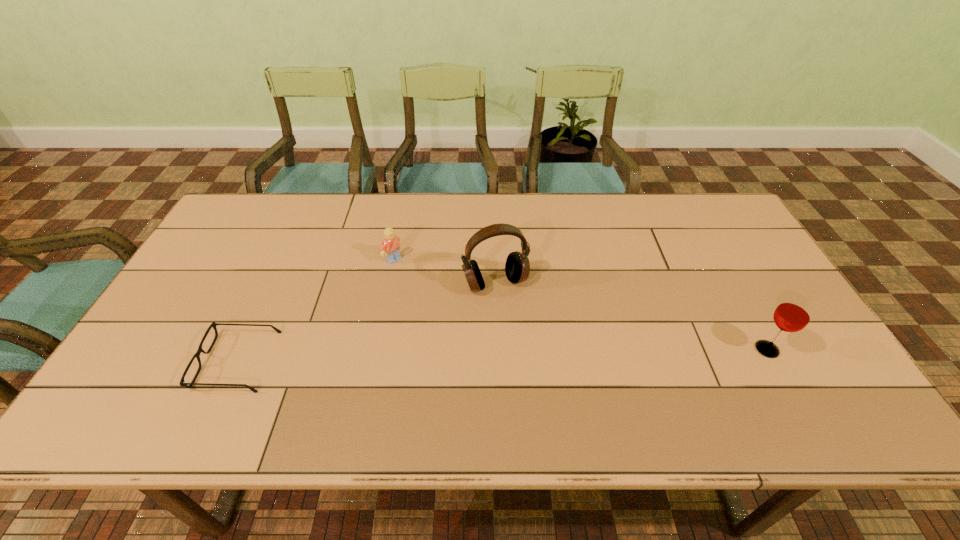
Identify the location of vacant space that satisfies the following two spatial constraints: 1. on the front side of the headset; 2. on the left side of the rightmost object. Image resolution: width=960 pixels, height=540 pixels. (497, 349).